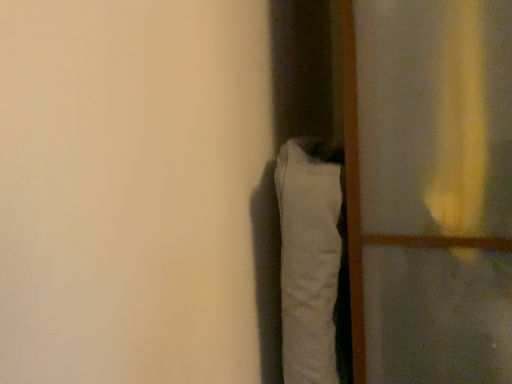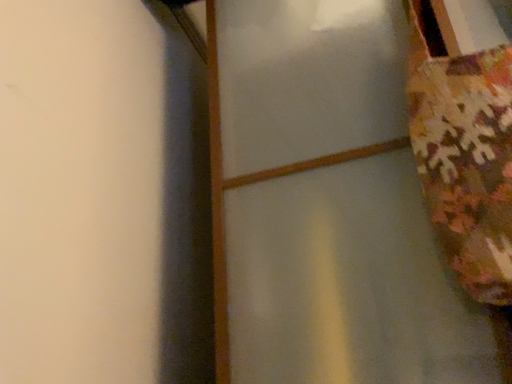
Question: Which way did the camera rotate in the video?

Choices:
 (A) rotated downward
 (B) rotated upward

Answer: (B)